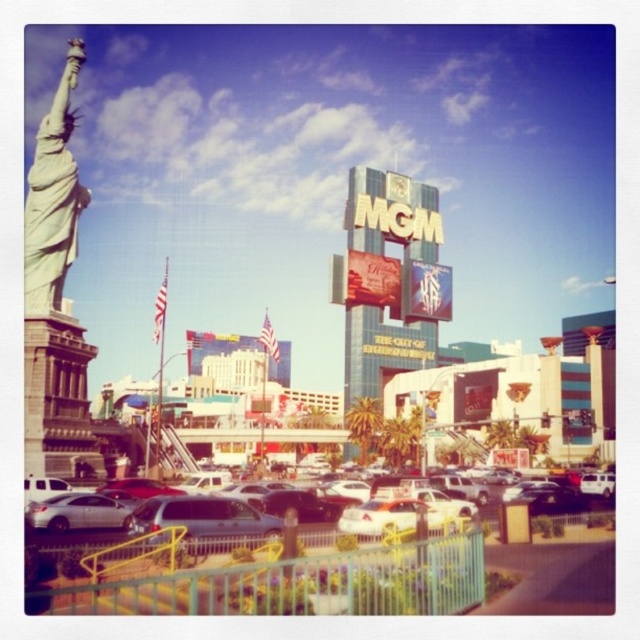
Question: Is silver metallic sedan at center above white marble statue at left?

Choices:
 (A) no
 (B) yes

Answer: (A)

Question: Does silver metallic sedan at center have a greater width compared to white marble statue at left?

Choices:
 (A) yes
 (B) no

Answer: (A)

Question: Does silver metallic sedan at center appear over white marble statue at left?

Choices:
 (A) no
 (B) yes

Answer: (A)

Question: Among these objects, which one is nearest to the camera?

Choices:
 (A) white marble statue at left
 (B) silver metallic sedan at center

Answer: (B)

Question: Which point is closer to the camera taking this photo?

Choices:
 (A) (76, 60)
 (B) (108, 493)

Answer: (B)

Question: Which point is farther to the camera?

Choices:
 (A) white marble statue at left
 (B) silver metallic sedan at center

Answer: (A)